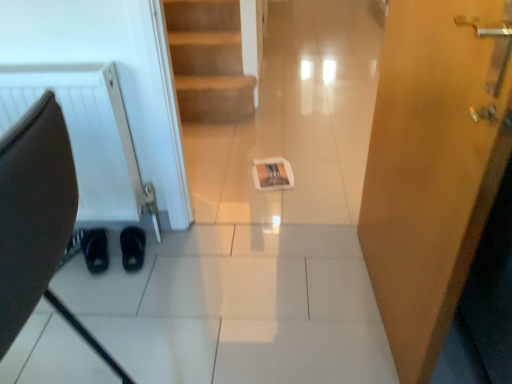
In order to click on vacant space that's between wooden door at right and black suede shoes at lower left, the first footwear positioned from the right in this screenshot , I will do `click(267, 283)`.